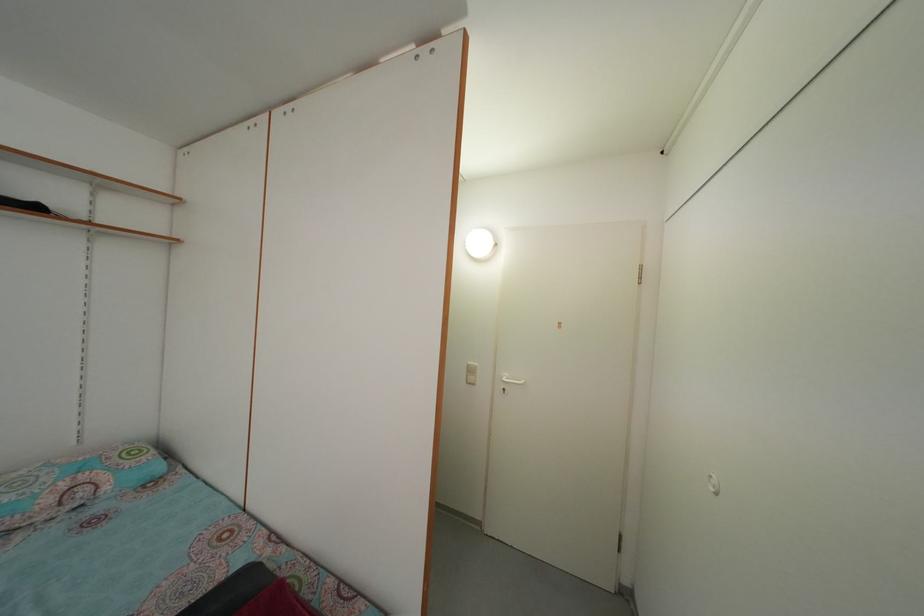
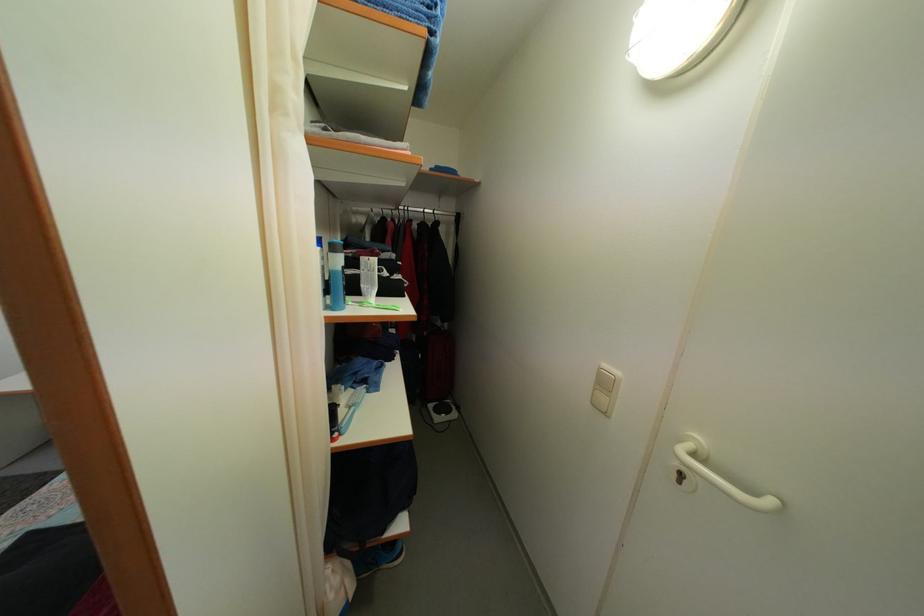
Question: The camera is either moving clockwise (left) or counter-clockwise (right) around the object. The first image is from the beginning of the video and the second image is from the end. Is the camera moving left or right when shooting the video?

Choices:
 (A) Left
 (B) Right

Answer: (B)